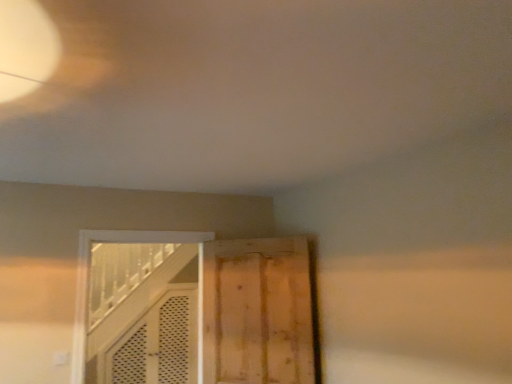
Question: Would you say white wooden door at center, the 1th door in the left-to-right sequence, is to the left or to the right of wooden door at center, acting as the second door starting from the left, in the picture?

Choices:
 (A) left
 (B) right

Answer: (A)

Question: From a real-world perspective, is white wooden door at center, the 1th door in the left-to-right sequence, above or below wooden door at center, positioned as the first door in right-to-left order?

Choices:
 (A) below
 (B) above

Answer: (B)

Question: In terms of size, does white wooden door at center, the second door in the right-to-left sequence, appear bigger or smaller than wooden door at center, positioned as the first door in right-to-left order?

Choices:
 (A) small
 (B) big

Answer: (B)

Question: Is wooden door at center, acting as the second door starting from the left, inside the boundaries of white wooden door at center, the second door in the right-to-left sequence, or outside?

Choices:
 (A) outside
 (B) inside

Answer: (A)

Question: From the image's perspective, is wooden door at center, acting as the second door starting from the left, located above or below white wooden door at center, the 1th door in the left-to-right sequence?

Choices:
 (A) above
 (B) below

Answer: (A)

Question: Considering the positions of wooden door at center, positioned as the first door in right-to-left order, and white wooden door at center, the second door in the right-to-left sequence, in the image, is wooden door at center, positioned as the first door in right-to-left order, taller or shorter than white wooden door at center, the second door in the right-to-left sequence,?

Choices:
 (A) short
 (B) tall

Answer: (A)

Question: Is wooden door at center, positioned as the first door in right-to-left order, in front of or behind white wooden door at center, the second door in the right-to-left sequence, in the image?

Choices:
 (A) behind
 (B) front

Answer: (A)